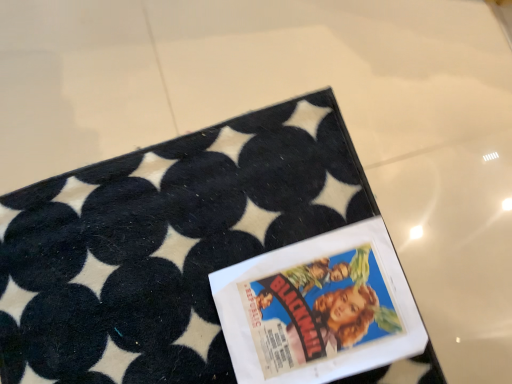
Question: Should I look upward or downward to see matte paper comic book at center?

Choices:
 (A) down
 (B) up

Answer: (A)

Question: Does black felt rug at upper center turn towards matte paper comic book at center?

Choices:
 (A) no
 (B) yes

Answer: (B)

Question: Does black felt rug at upper center appear on the left side of matte paper comic book at center?

Choices:
 (A) yes
 (B) no

Answer: (A)

Question: Are black felt rug at upper center and matte paper comic book at center located far from each other?

Choices:
 (A) no
 (B) yes

Answer: (A)

Question: Considering the relative positions of black felt rug at upper center and matte paper comic book at center in the image provided, is black felt rug at upper center in front of matte paper comic book at center?

Choices:
 (A) yes
 (B) no

Answer: (A)

Question: Could matte paper comic book at center be considered to be inside black felt rug at upper center?

Choices:
 (A) no
 (B) yes

Answer: (B)

Question: From a real-world perspective, is black felt rug at upper center under matte paper comic book at center?

Choices:
 (A) yes
 (B) no

Answer: (B)

Question: Considering the relative sizes of matte paper comic book at center and black felt rug at upper center in the image provided, is matte paper comic book at center smaller than black felt rug at upper center?

Choices:
 (A) no
 (B) yes

Answer: (B)

Question: From a real-world perspective, is matte paper comic book at center under black felt rug at upper center?

Choices:
 (A) no
 (B) yes

Answer: (B)

Question: Is matte paper comic book at center taller than black felt rug at upper center?

Choices:
 (A) no
 (B) yes

Answer: (B)

Question: Is the depth of matte paper comic book at center less than that of black felt rug at upper center?

Choices:
 (A) no
 (B) yes

Answer: (A)

Question: From the image's perspective, would you say matte paper comic book at center is positioned over black felt rug at upper center?

Choices:
 (A) no
 (B) yes

Answer: (A)

Question: Can you confirm if matte paper comic book at center is positioned to the left of black felt rug at upper center?

Choices:
 (A) no
 (B) yes

Answer: (A)

Question: Choose the correct answer: Is matte paper comic book at center inside black felt rug at upper center or outside it?

Choices:
 (A) inside
 (B) outside

Answer: (A)